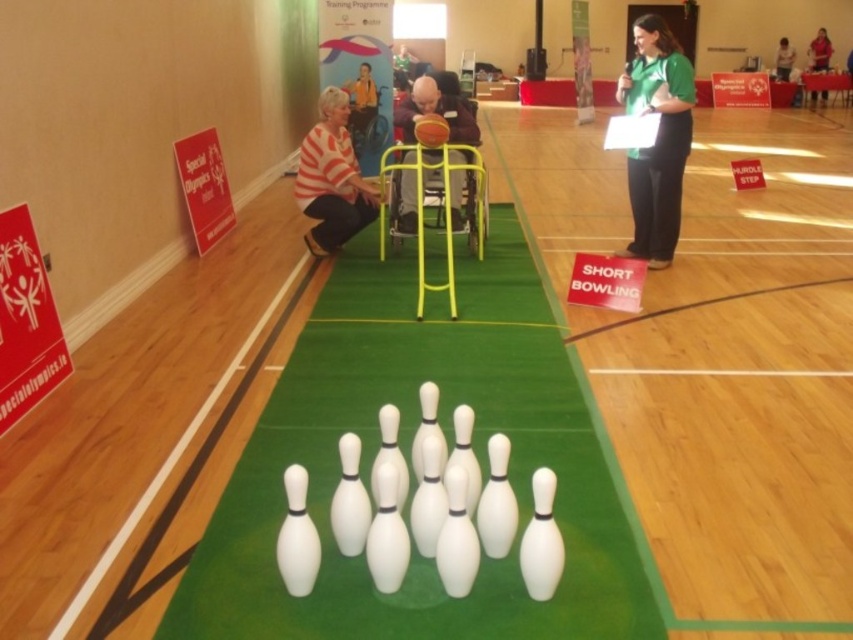
Is matte green shirt at upper center above green fabric shirt at upper center?

Yes, matte green shirt at upper center is above green fabric shirt at upper center.

Who is positioned more to the right, matte green shirt at upper center or green fabric shirt at upper center?

Positioned to the right is matte green shirt at upper center.

Is point (817, 67) closer to viewer compared to point (781, 80)?

Yes, it is.

Where is `matte green shirt at upper center`? matte green shirt at upper center is located at coordinates (819, 51).

Can you confirm if white plastic bowling pins at center is positioned above matte green shirt at upper center?

Incorrect, white plastic bowling pins at center is not positioned above matte green shirt at upper center.

Where is `white plastic bowling pins at center`? Image resolution: width=853 pixels, height=640 pixels. white plastic bowling pins at center is located at coordinates (361, 100).

At what (x,y) coordinates should I click in order to perform the action: click on green fabric shirt at upper right. Please return your answer as a coordinate pair (x, y). The width and height of the screenshot is (853, 640). Looking at the image, I should click on (656, 138).

The image size is (853, 640). Find the location of `green fabric shirt at upper right`. green fabric shirt at upper right is located at coordinates (656, 138).